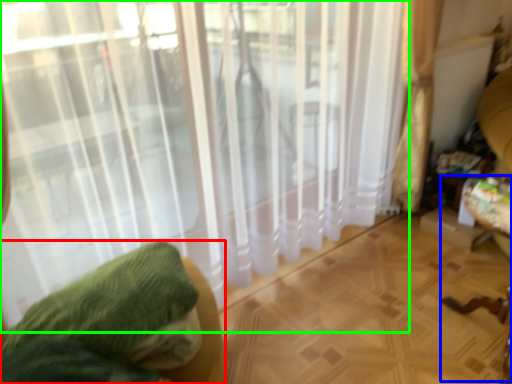
Question: Which is farther away from furniture (highlighted by a red box)? swivel chair (highlighted by a blue box) or curtain (highlighted by a green box)?

Choices:
 (A) swivel chair
 (B) curtain

Answer: (A)